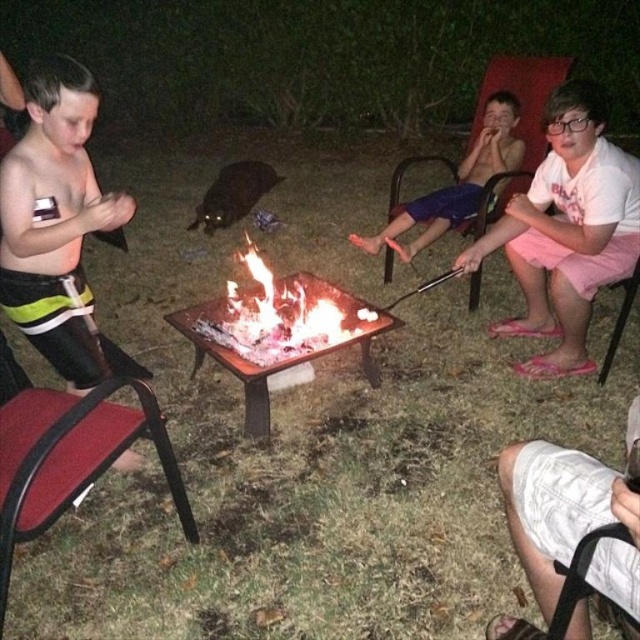
In the nighttime backyard scene with a fire pit and children sitting on red plastic chairs, where exactly is the black matte shorts at left located in terms of coordinates?

The black matte shorts at left is located at coordinates point (54, 218).

You are standing at the origin point of the image. Looking at the white cotton shorts at lower right, can you tell me their exact coordinates?

The white cotton shorts at lower right are located at coordinates point (568, 520).

You are a parent supervising the children by the fire pit. You notice the black matte shorts at left and the blue shorts at center. Which child is closer to the fire pit?

The blue shorts at center is closer to the fire pit because the black matte shorts at left is 2.17 meters away from it.